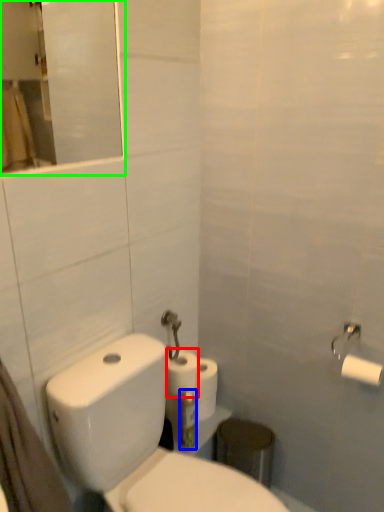
Question: Which object is positioned farthest from toilet paper (highlighted by a red box)? Select from toothbrush (highlighted by a blue box) and mirror (highlighted by a green box).

Choices:
 (A) toothbrush
 (B) mirror

Answer: (B)